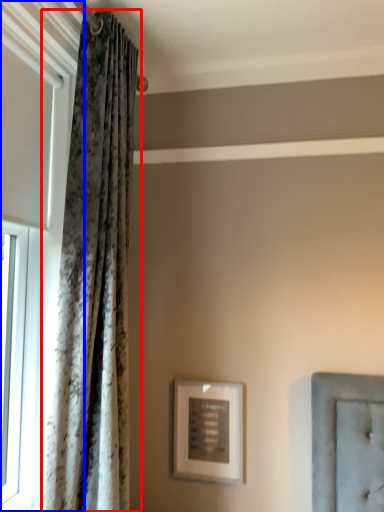
Question: Which of the following is the farthest to the observer, curtain (highlighted by a red box) or window (highlighted by a blue box)?

Choices:
 (A) curtain
 (B) window

Answer: (A)